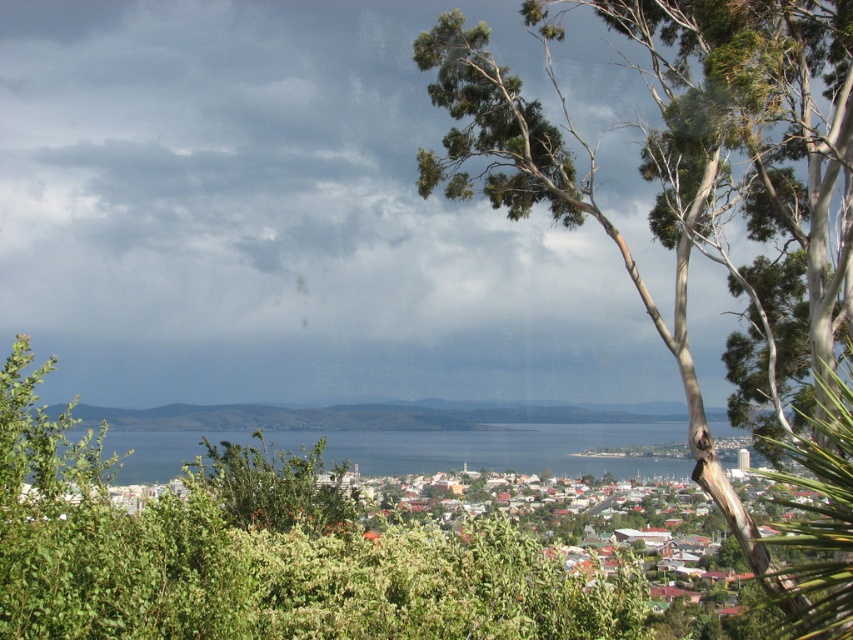
Question: Considering the real-world distances, which object is farthest from the green leafy bush at center?

Choices:
 (A) blue water at center
 (B) green textured tree at upper right

Answer: (A)

Question: Which of the following is the farthest from the observer?

Choices:
 (A) green textured tree at upper right
 (B) blue water at center

Answer: (B)

Question: Is blue water at center smaller than green leafy bush at center?

Choices:
 (A) yes
 (B) no

Answer: (B)

Question: Which object appears closest to the camera in this image?

Choices:
 (A) green textured tree at upper right
 (B) blue water at center
 (C) green leafy bush at center

Answer: (A)

Question: Is green textured tree at upper right further to the viewer compared to green leafy bush at center?

Choices:
 (A) yes
 (B) no

Answer: (B)

Question: Is blue water at center closer to the viewer compared to green leafy bush at center?

Choices:
 (A) yes
 (B) no

Answer: (A)